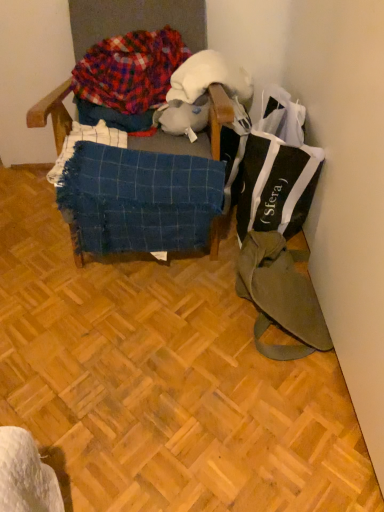
Image resolution: width=384 pixels, height=512 pixels. Describe the element at coordinates (139, 199) in the screenshot. I see `blue woven blanket at center` at that location.

This screenshot has width=384, height=512. Find the location of `white wool at upper center`. white wool at upper center is located at coordinates (208, 78).

Describe the element at coordinates (277, 170) in the screenshot. I see `black fabric bag at upper right` at that location.

Identify the location of black fabric bag at upper right. Image resolution: width=384 pixels, height=512 pixels. (277, 170).

What do you see at coordinates (162, 380) in the screenshot? Image resolution: width=384 pixels, height=512 pixels. I see `wooden parquet floor at center` at bounding box center [162, 380].

This screenshot has width=384, height=512. In order to click on blue woven blanket at center in this screenshot , I will do `click(139, 199)`.

Locate an element on the screen. The width and height of the screenshot is (384, 512). messenger bag lying in front of the plaid fabric at upper left is located at coordinates (280, 295).

From the image's perspective, is plaid fabric at upper left under olive green canvas messenger bag at lower right?

Incorrect, from the image's perspective, plaid fabric at upper left is higher than olive green canvas messenger bag at lower right.

Is plaid fabric at upper left facing away from olive green canvas messenger bag at lower right?

No.

Does blue woven blanket at center have a lesser height compared to black fabric bag at upper right?

Indeed, blue woven blanket at center has a lesser height compared to black fabric bag at upper right.

Relative to black fabric bag at upper right, is blue woven blanket at center in front or behind?

Visually, blue woven blanket at center is located in front of black fabric bag at upper right.

From the image's perspective, between blue woven blanket at center and black fabric bag at upper right, which one is located above?

black fabric bag at upper right appears higher in the image.

Does point (170, 128) appear closer or farther from the camera than point (336, 434)?

Point (170, 128) appears to be farther away from the viewer than point (336, 434).

Considering the sizes of objects white plush toy at center and wooden parquet floor at center in the image provided, who is smaller, white plush toy at center or wooden parquet floor at center?

Smaller between the two is white plush toy at center.

In terms of width, does blue woven blanket at center look wider or thinner when compared to wooden parquet floor at center?

In the image, blue woven blanket at center appears to be more narrow than wooden parquet floor at center.

Could you tell me if blue woven blanket at center is facing wooden parquet floor at center?

No, blue woven blanket at center is not oriented towards wooden parquet floor at center.

Is blue woven blanket at center not inside wooden parquet floor at center?

Yes, blue woven blanket at center is not within wooden parquet floor at center.

Considering the sizes of blue woven blanket at center and wooden parquet floor at center in the image, is blue woven blanket at center bigger or smaller than wooden parquet floor at center?

In the image, blue woven blanket at center appears to be smaller than wooden parquet floor at center.

Is blue woven blanket at center further to the viewer compared to olive green canvas messenger bag at lower right?

That is True.

Find the location of `blanket behind the olive green canvas messenger bag at lower right`. blanket behind the olive green canvas messenger bag at lower right is located at coordinates (139, 199).

From the image's perspective, is blue woven blanket at center above olive green canvas messenger bag at lower right?

Yes, from the image's perspective, blue woven blanket at center is above olive green canvas messenger bag at lower right.

Consider the image. Is blue woven blanket at center outside of olive green canvas messenger bag at lower right?

Absolutely, blue woven blanket at center is external to olive green canvas messenger bag at lower right.

This screenshot has width=384, height=512. What are the coordinates of `waste lying behind the blue woven blanket at center` in the screenshot? It's located at (130, 70).

Does plaid fabric at upper left turn towards blue woven blanket at center?

Yes, plaid fabric at upper left faces towards blue woven blanket at center.

Does point (121, 102) lie in front of point (131, 188)?

That is False.

From the image's perspective, is black fabric bag at upper right beneath wooden parquet floor at center?

No, from the image's perspective, black fabric bag at upper right is not below wooden parquet floor at center.

Which of these two, black fabric bag at upper right or wooden parquet floor at center, stands taller?

black fabric bag at upper right.

Find the location of a particular element. grocery bag behind the wooden parquet floor at center is located at coordinates (277, 170).

Can we say black fabric bag at upper right lies outside wooden parquet floor at center?

Indeed, black fabric bag at upper right is completely outside wooden parquet floor at center.

This screenshot has width=384, height=512. Find the location of `waste above the olive green canvas messenger bag at lower right (from the image's perspective)`. waste above the olive green canvas messenger bag at lower right (from the image's perspective) is located at coordinates (130, 70).

Where is `grocery bag that appears on the right of blue woven blanket at center`? The image size is (384, 512). grocery bag that appears on the right of blue woven blanket at center is located at coordinates (277, 170).

Consider the image. Estimate the real-world distances between objects in this image. Which object is closer to white wool at upper center, black fabric bag at upper right or white plush toy at center?

The object closer to white wool at upper center is white plush toy at center.

Based on their spatial positions, is blue woven blanket at center or wooden parquet floor at center further from olive green canvas messenger bag at lower right?

blue woven blanket at center.

Looking at the image, which one is located further to plaid fabric at upper left, blue woven blanket at center or white wool at upper center?

blue woven blanket at center lies further to plaid fabric at upper left than the other object.

Considering their positions, is blue woven blanket at center positioned further to white wool at upper center than white plush toy at center?

The object further to white wool at upper center is blue woven blanket at center.

Estimate the real-world distances between objects in this image. Which object is further from plaid fabric at upper left, wooden chair at center or blue woven blanket at center?

blue woven blanket at center.

Which object lies further to the anchor point plaid fabric at upper left, white wool at upper center or wooden chair at center?

wooden chair at center is positioned further to the anchor plaid fabric at upper left.

Consider the image. Looking at the image, which one is located further to plaid fabric at upper left, blue woven blanket at center or white plush toy at center?

Among the two, blue woven blanket at center is located further to plaid fabric at upper left.

Which object lies nearer to the anchor point wooden parquet floor at center, olive green canvas messenger bag at lower right or black fabric bag at upper right?

olive green canvas messenger bag at lower right.

The image size is (384, 512). In order to click on blanket located between wooden parquet floor at center and olive green canvas messenger bag at lower right in the left-right direction in this screenshot , I will do `click(139, 199)`.

Identify the location of blanket that lies between white wool at upper center and wooden parquet floor at center from top to bottom. This screenshot has width=384, height=512. coord(139,199).

The image size is (384, 512). Identify the location of animal that lies between plaid fabric at upper left and olive green canvas messenger bag at lower right from top to bottom. (183, 117).

Locate an element on the screen. This screenshot has height=512, width=384. blanket that lies between wooden chair at center and olive green canvas messenger bag at lower right from top to bottom is located at coordinates (139, 199).